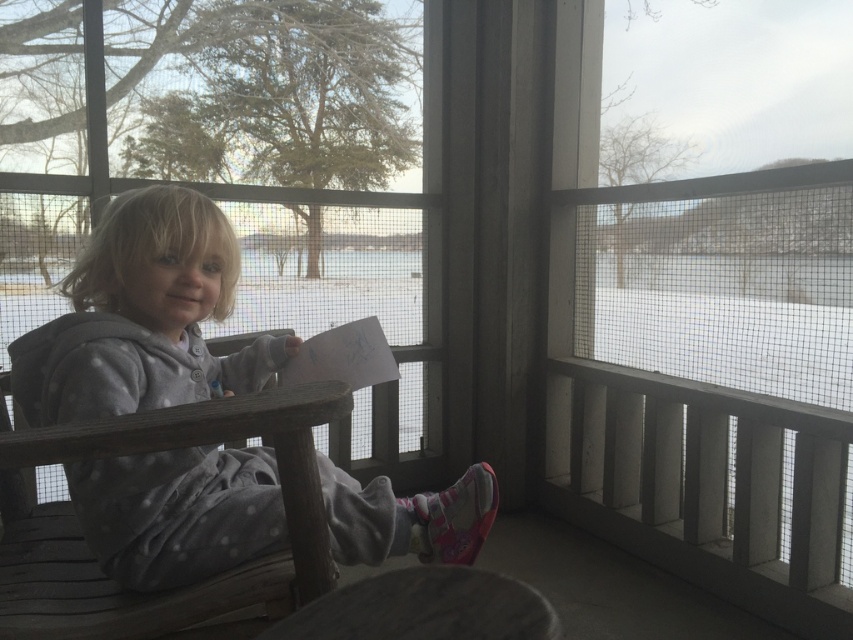
You are a delivery robot with a 3.30 feet wide package. You need to deliver it through the path between the transparent plastic window at center and the gray fleece hoodie at center. Can the package fit through the path?

The distance between the transparent plastic window at center and the gray fleece hoodie at center is 9.90 feet. Since the package is 3.30 feet wide, it can fit through the path as the distance is greater than the package width.

You are standing on the screened porch and want to look through the screen panels to see the frozen water. There are two points marked on the screen panels at coordinates point (10, 365) and point (296, 566). Which point is closer to you as you stand on the porch?

Point (296, 566) is closer to you because point (10, 365) is behind it.

From the picture: You are a parent looking for your child who is wearing a gray fleece hoodie at center. You see the wooden chair at center in the porch. Where might you find the child?

The gray fleece hoodie at center is positioned over the wooden chair at center, so the child wearing the gray fleece hoodie at center is likely sitting on the wooden chair at center.